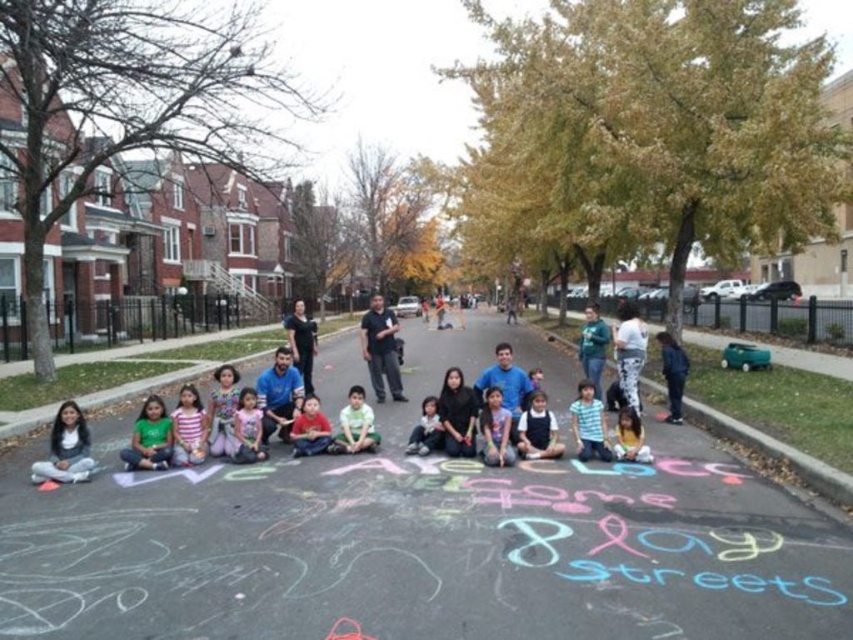
Question: Estimate the real-world distances between objects in this image. Which object is farther from the striped shirt at center?

Choices:
 (A) black asphalt at center
 (B) red shirt at center

Answer: (B)

Question: Does black asphalt at center appear over matte yellow shirt at center?

Choices:
 (A) yes
 (B) no

Answer: (B)

Question: Can you confirm if striped shirt at center is positioned above matte pink shirt at center?

Choices:
 (A) yes
 (B) no

Answer: (A)

Question: Which point is closer to the camera?

Choices:
 (A) red shirt at center
 (B) pink striped shirt at center
 (C) matte pink shirt at center

Answer: (B)

Question: Which of the following is the closest to the observer?

Choices:
 (A) light green fabric shirt at center
 (B) pink striped shirt at center
 (C) matte white shirt at lower left
 (D) striped shirt at center

Answer: (C)

Question: Can you confirm if matte pink shirt at center is thinner than matte yellow shirt at center?

Choices:
 (A) yes
 (B) no

Answer: (B)